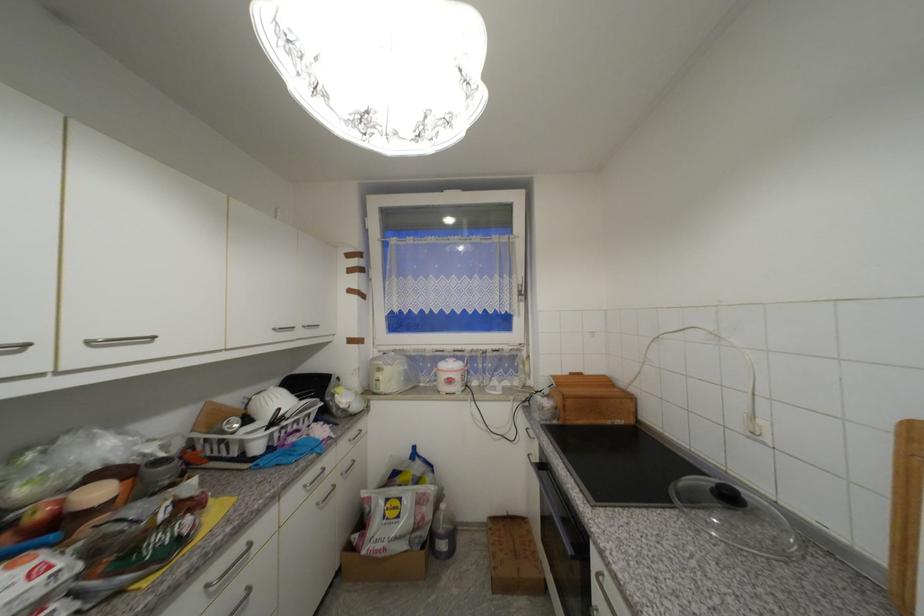
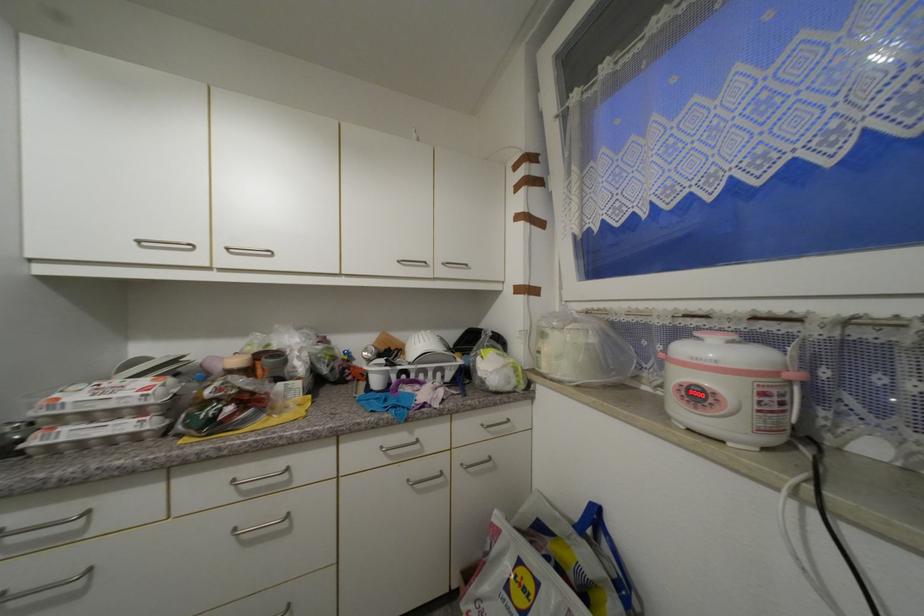
The point at (310, 328) is marked in the first image. Where is the corresponding point in the second image?

(448, 265)